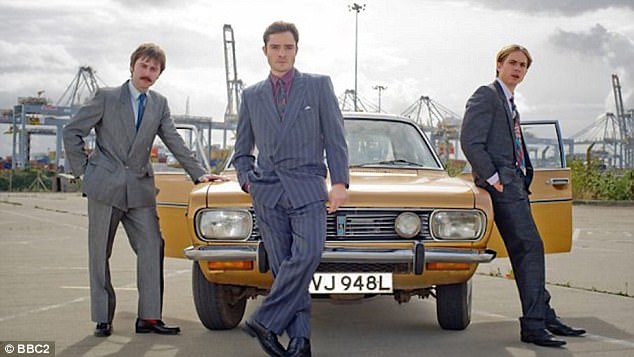
Where is `hood`? hood is located at coordinates (425, 190).